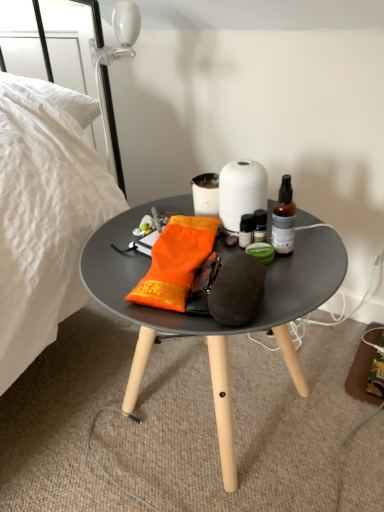
Question: Can white matte vase at center be found inside brown glass bottle at center?

Choices:
 (A) yes
 (B) no

Answer: (B)

Question: Is brown glass bottle at center in contact with white matte vase at center?

Choices:
 (A) yes
 (B) no

Answer: (A)

Question: Could you tell me if brown glass bottle at center is facing white matte vase at center?

Choices:
 (A) no
 (B) yes

Answer: (A)

Question: Does brown glass bottle at center have a greater width compared to white matte vase at center?

Choices:
 (A) no
 (B) yes

Answer: (A)

Question: Does brown glass bottle at center have a smaller size compared to white matte vase at center?

Choices:
 (A) yes
 (B) no

Answer: (A)

Question: From the image's perspective, is brown glass bottle at center on top of white matte vase at center?

Choices:
 (A) no
 (B) yes

Answer: (A)

Question: Is white matte vase at center further to the viewer compared to matte gray coffee table at center?

Choices:
 (A) no
 (B) yes

Answer: (B)

Question: Is matte gray coffee table at center located within white matte vase at center?

Choices:
 (A) yes
 (B) no

Answer: (B)

Question: Is white matte vase at center not inside matte gray coffee table at center?

Choices:
 (A) yes
 (B) no

Answer: (A)

Question: Does white matte vase at center have a lesser height compared to matte gray coffee table at center?

Choices:
 (A) no
 (B) yes

Answer: (B)

Question: Is white matte vase at center aimed at matte gray coffee table at center?

Choices:
 (A) no
 (B) yes

Answer: (A)

Question: Considering the relative sizes of white matte vase at center and matte gray coffee table at center in the image provided, is white matte vase at center bigger than matte gray coffee table at center?

Choices:
 (A) yes
 (B) no

Answer: (B)

Question: From the image's perspective, does orange fabric pouch at center appear higher than matte gray coffee table at center?

Choices:
 (A) no
 (B) yes

Answer: (B)